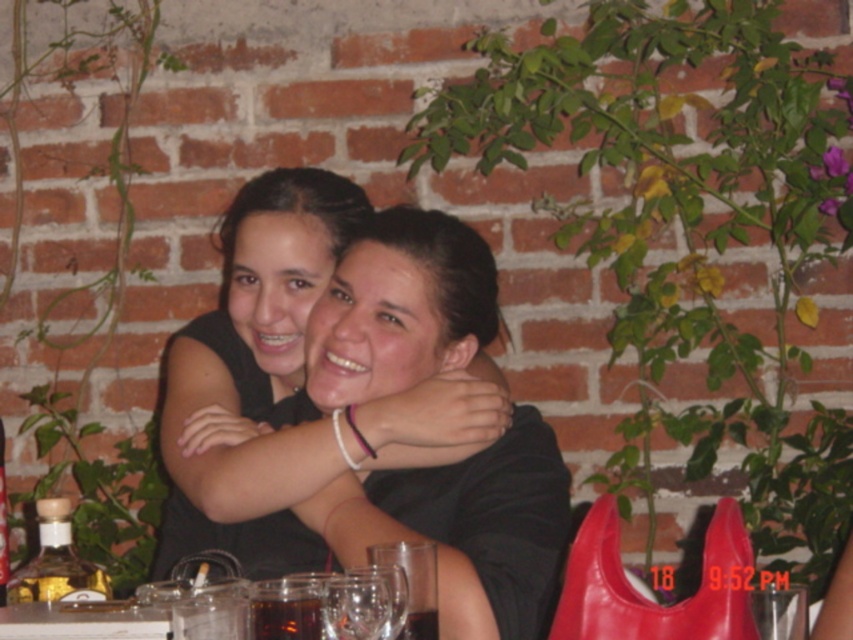
You are a photographer setting up a shot of two people sitting at a table. You have a black matte shirt at center and a transparent glass at lower center in your frame. Which object should you adjust to avoid the glass reflecting the shirt? Please explain your reasoning.

The black matte shirt at center is much taller than the transparent glass at lower center. To avoid the glass reflecting the shirt, you should lower the black matte shirt at center or raise the transparent glass at lower center so that the shirt is not within the reflection range of the glass.

You are an architect designing a new restaurant. You need to place a table exactly at the coordinates given in the description. Where should you place the table so that it aligns with the position of the black matte shirt at center?

The table should be placed at the coordinates point (474, 529) to align with the position of the black matte shirt at center.